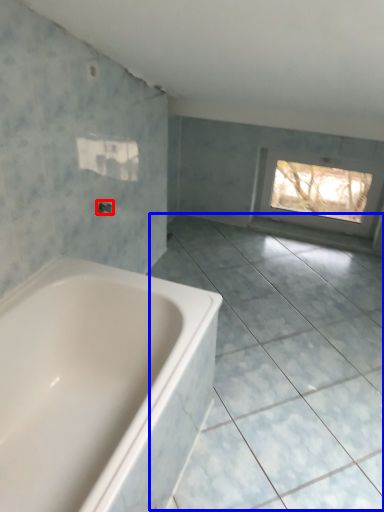
Question: Which object is closer to the camera taking this photo, tap (highlighted by a red box) or ceramic tile (highlighted by a blue box)?

Choices:
 (A) tap
 (B) ceramic tile

Answer: (B)